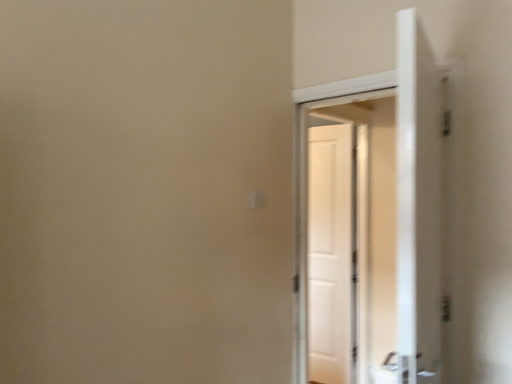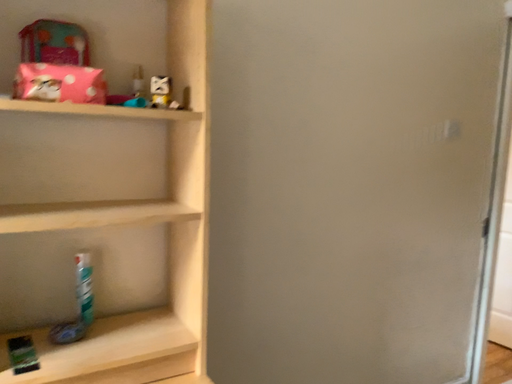
Question: Which way did the camera rotate in the video?

Choices:
 (A) rotated upward
 (B) rotated downward

Answer: (B)